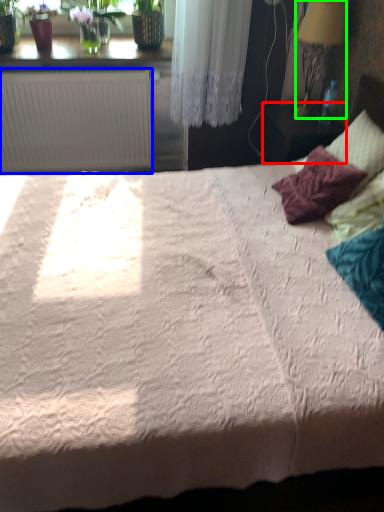
Question: Which object is positioned farthest from table (highlighted by a red box)? Select from radiator (highlighted by a blue box) and lamp (highlighted by a green box).

Choices:
 (A) radiator
 (B) lamp

Answer: (A)